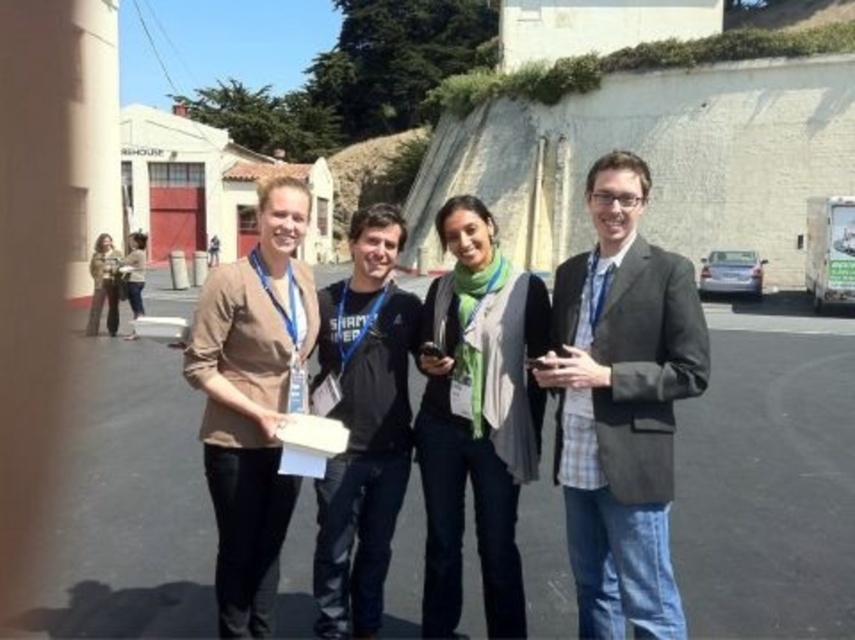
Question: Based on their relative distances, which object is nearer to the matte khaki jacket at left?

Choices:
 (A) green knitted scarf at center
 (B) matte beige sweater at left
 (C) matte gray blazer at center
 (D) beige fabric shirt at center

Answer: (B)

Question: Does matte gray blazer at center appear on the right side of matte beige sweater at left?

Choices:
 (A) no
 (B) yes

Answer: (B)

Question: Which point is closer to the camera taking this photo?

Choices:
 (A) (327, 372)
 (B) (86, 328)
 (C) (538, 337)

Answer: (C)

Question: Which is nearer to the green knitted scarf at center?

Choices:
 (A) black cotton t-shirt at center
 (B) matte beige sweater at left
 (C) matte khaki jacket at left

Answer: (A)

Question: In this image, where is green knitted scarf at center located relative to matte beige sweater at left?

Choices:
 (A) left
 (B) right

Answer: (B)

Question: Is matte khaki jacket at left to the left of matte beige sweater at left from the viewer's perspective?

Choices:
 (A) yes
 (B) no

Answer: (B)